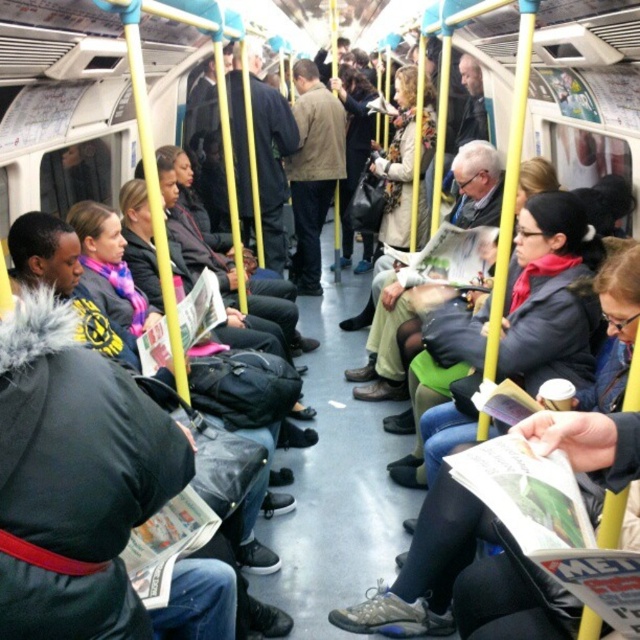
Who is positioned more to the left, brown leather jacket at center or dark blue jacket at center?

dark blue jacket at center

Looking at this image, is the position of brown leather jacket at center less distant than that of dark blue jacket at center?

No, brown leather jacket at center is further to the viewer.

The image size is (640, 640). In order to click on brown leather jacket at center in this screenshot , I will do `click(312, 170)`.